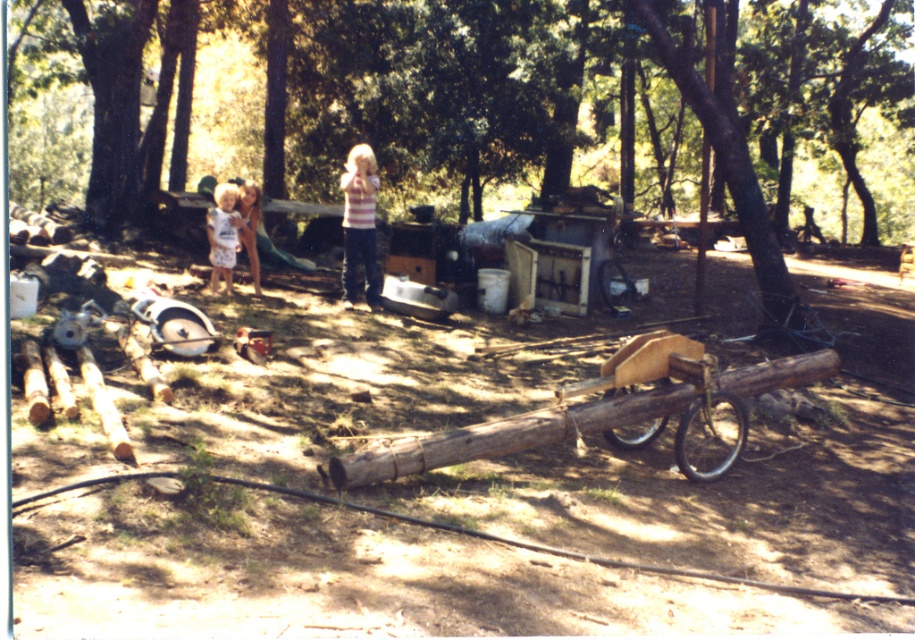
Looking at this image, measure the distance between white cotton dress at left and camera.

white cotton dress at left is 11.56 meters away from camera.

This screenshot has height=640, width=915. What do you see at coordinates (223, 234) in the screenshot?
I see `white cotton dress at left` at bounding box center [223, 234].

This screenshot has width=915, height=640. In order to click on white cotton dress at left in this screenshot , I will do `click(223, 234)`.

Can you confirm if wooden cart at center is positioned to the right of striped shirt at center?

Indeed, wooden cart at center is positioned on the right side of striped shirt at center.

Does wooden cart at center have a greater width compared to striped shirt at center?

Yes.

Between point (428, 456) and point (374, 257), which one is positioned behind?

The point (374, 257) is more distant.

The height and width of the screenshot is (640, 915). Find the location of `wooden cart at center`. wooden cart at center is located at coordinates (502, 435).

Who is positioned more to the right, brown rough log at lower center or striped shirt at center?

From the viewer's perspective, brown rough log at lower center appears more on the right side.

Does point (842, 19) lie behind point (357, 176)?

Yes.

You are a GUI agent. You are given a task and a screenshot of the screen. Output one action in this format:
    pyautogui.click(x=<x>, y=<y>)
    Task: Click on the brown rough log at lower center
    
    Given the screenshot: What is the action you would take?
    pyautogui.click(x=564, y=88)